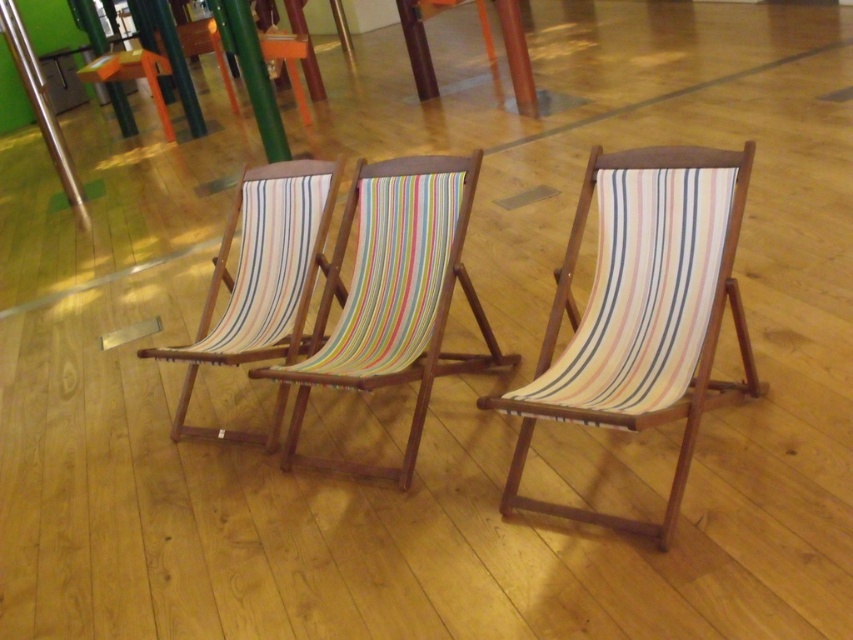
Question: Does brushed metal pole at upper left have a larger size compared to green wood pole at center?

Choices:
 (A) yes
 (B) no

Answer: (A)

Question: Does multicolored striped fabric at center have a smaller size compared to brushed metal pole at upper left?

Choices:
 (A) yes
 (B) no

Answer: (A)

Question: Which of the following is the closest to the observer?

Choices:
 (A) brushed metal pole at upper left
 (B) striped fabric deck chair at center

Answer: (B)

Question: Does striped fabric deck chair at center appear on the left side of multicolored striped fabric at center?

Choices:
 (A) no
 (B) yes

Answer: (A)

Question: Among these points, which one is nearest to the camera?

Choices:
 (A) (375, 385)
 (B) (624, 516)
 (C) (250, 92)

Answer: (B)

Question: Which point appears closest to the camera in this image?

Choices:
 (A) (22, 60)
 (B) (695, 364)
 (C) (180, 394)
 (D) (387, 253)

Answer: (B)